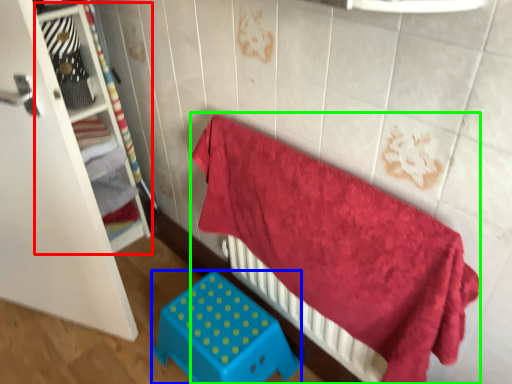
Question: Which object is the farthest from shelf (highlighted by a red box)? Choose among these: furniture (highlighted by a blue box) or bed (highlighted by a green box).

Choices:
 (A) furniture
 (B) bed

Answer: (B)